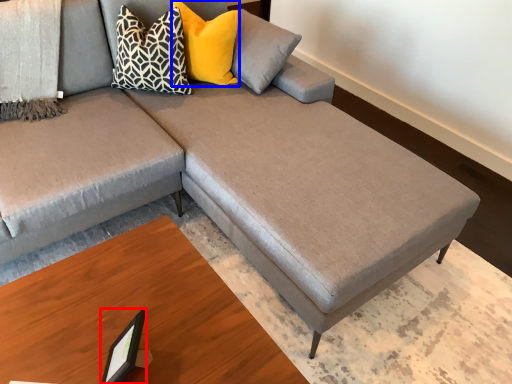
Question: Which of the following is the closest to the observer, picture frame (highlighted by a red box) or pillow (highlighted by a blue box)?

Choices:
 (A) picture frame
 (B) pillow

Answer: (A)